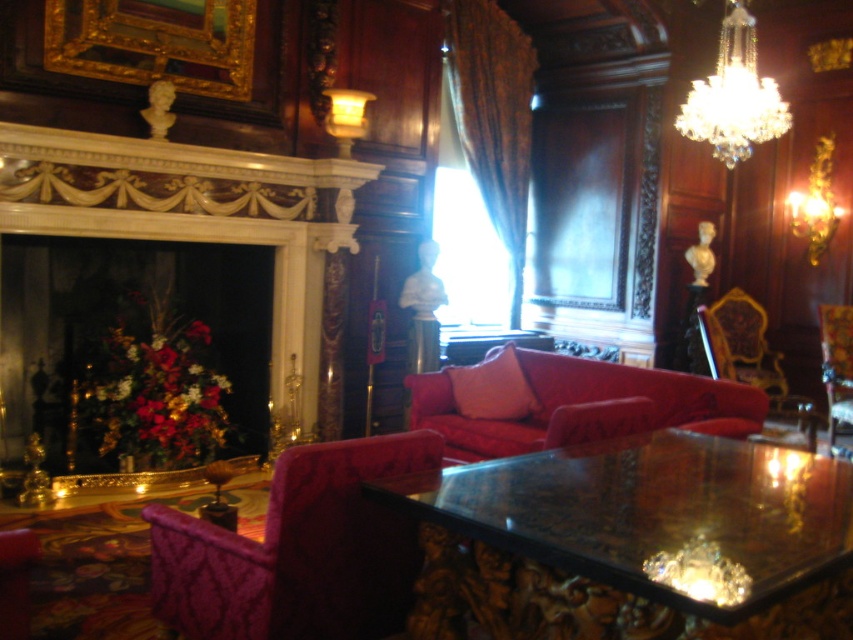
You are standing in the room and want to sit down. There is a gold ornate chair at right. Can you reach it without moving more than 5 meters?

The gold ornate chair at right is 5.01 meters from viewer, so you cannot reach it without moving more than 5 meters.

You are a guest entering the room and want to sit in one of the chairs at the right side of the room. Which chair, the gold ornate chair at right or the velvet chair at right, would you choose if you prefer a more spacious seating option?

The gold ornate chair at right is larger in size than the velvet chair at right, so you should choose the gold ornate chair at right for a more spacious seating option.

You are standing in the grand room and want to sit in one of the chairs. If you walk towards the right side of the room, which chair will you encounter first, the gold ornate chair at right or the velvet chair at right?

The gold ornate chair at right is to the left of the velvet chair at right, so you will encounter the gold ornate chair at right first when walking towards the right side of the room.